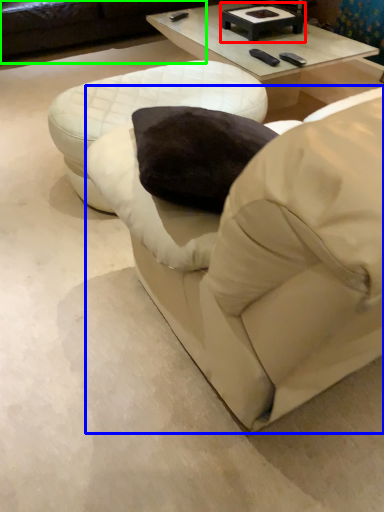
Question: Based on their relative distances, which object is farther from round table (highlighted by a red box)? Choose from bean bag chair (highlighted by a blue box) and studio couch (highlighted by a green box).

Choices:
 (A) bean bag chair
 (B) studio couch

Answer: (A)